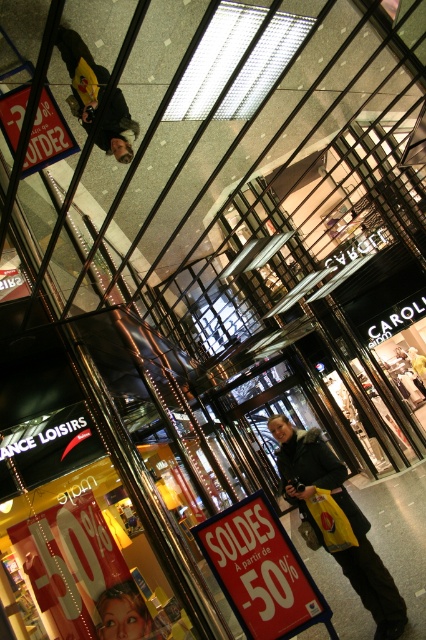
Question: Is red paper sign at center above dark green jacket at center?

Choices:
 (A) no
 (B) yes

Answer: (A)

Question: Among these points, which one is nearest to the camera?

Choices:
 (A) (x=129, y=116)
 (B) (x=328, y=627)
 (C) (x=376, y=611)

Answer: (B)

Question: Among these points, which one is farthest from the camera?

Choices:
 (A) (92, 84)
 (B) (344, 502)
 (C) (43, 122)

Answer: (A)

Question: Can you confirm if red paper sign at center is wider than red fabric sign at upper left?

Choices:
 (A) yes
 (B) no

Answer: (A)

Question: Which point is closer to the camera taking this photo?

Choices:
 (A) (118, 108)
 (B) (342, 525)
 (C) (23, 106)

Answer: (B)

Question: From the image, what is the correct spatial relationship of dark green jacket at center in relation to red fabric sign at upper left?

Choices:
 (A) above
 (B) below

Answer: (B)